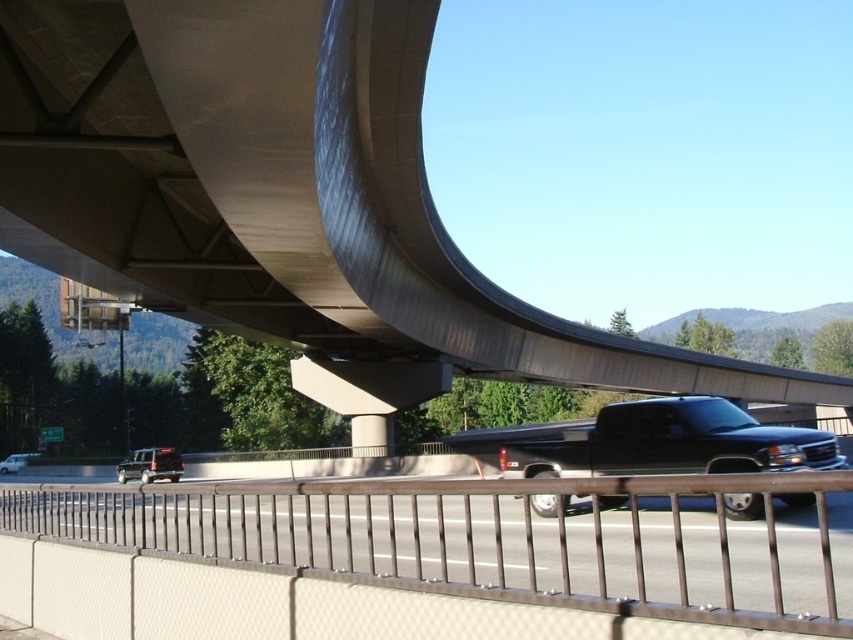
Based on the photo, you are standing at the origin point of the coordinate system in this scene. You want to place a small traffic cone exactly at the location of the concrete at center. What are the coordinates where you should place the cone?

The coordinates for the concrete at center are at point (286, 196). Therefore, you should place the traffic cone at coordinates (286, 196).

You are standing at the point marked by coordinates point (286, 196) under the overpass. What material are you standing on?

The point (286, 196) marks concrete at center, so you are standing on concrete.

You are a pedestrian standing at the base of the overpass and want to cross the road to reach a bench on the other side. The road has two lanes. You see the concrete at center and the silver metallic sedan at lower left. Which object is nearer to you as you prepare to cross?

The concrete at center is closer to the viewer than the silver metallic sedan at lower left, so the concrete at center is nearer to you as you prepare to cross.